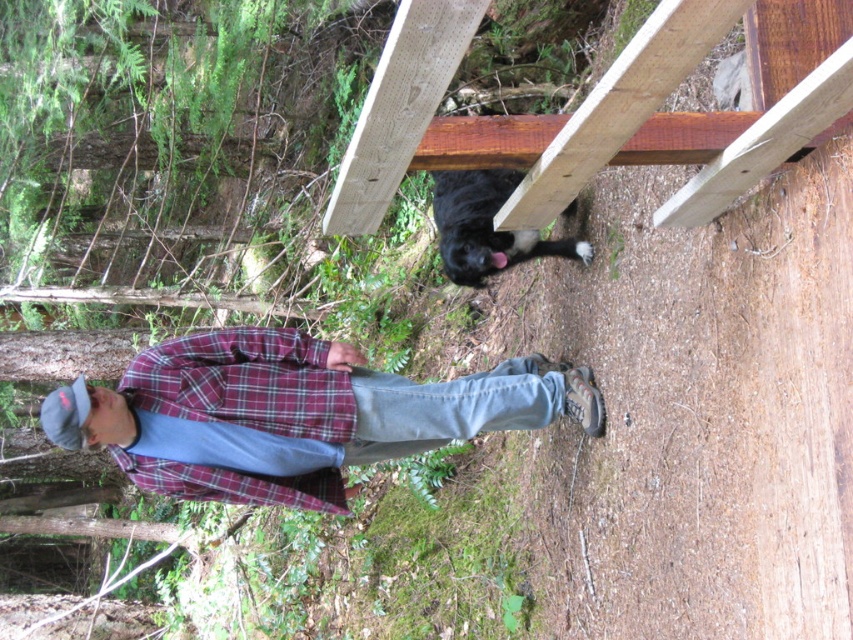
Consider the image. What is the color of the shirt at the point specified by the coordinates (300,410)?

The point at coordinates (300,410) corresponds to the plaid flannel shirt at center, which is red.

Based on the photo, you are a hiker who has just arrived at a forest trail. You notice two items labeled as plaid flannel shirt at center and plaid fabric at center in the scene. Which item is shorter in height?

The plaid flannel shirt at center has a lesser height compared to plaid fabric at center, so the plaid flannel shirt at center is shorter in height.